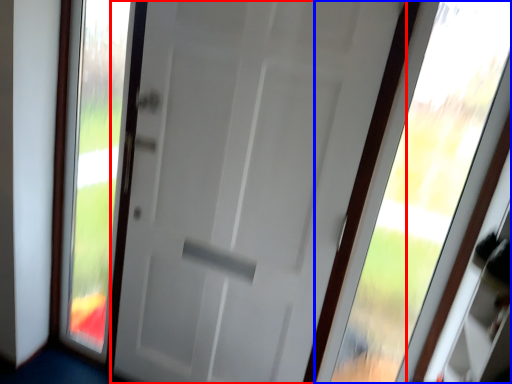
Question: Which object is closer to the camera taking this photo, door (highlighted by a red box) or window (highlighted by a blue box)?

Choices:
 (A) door
 (B) window

Answer: (B)